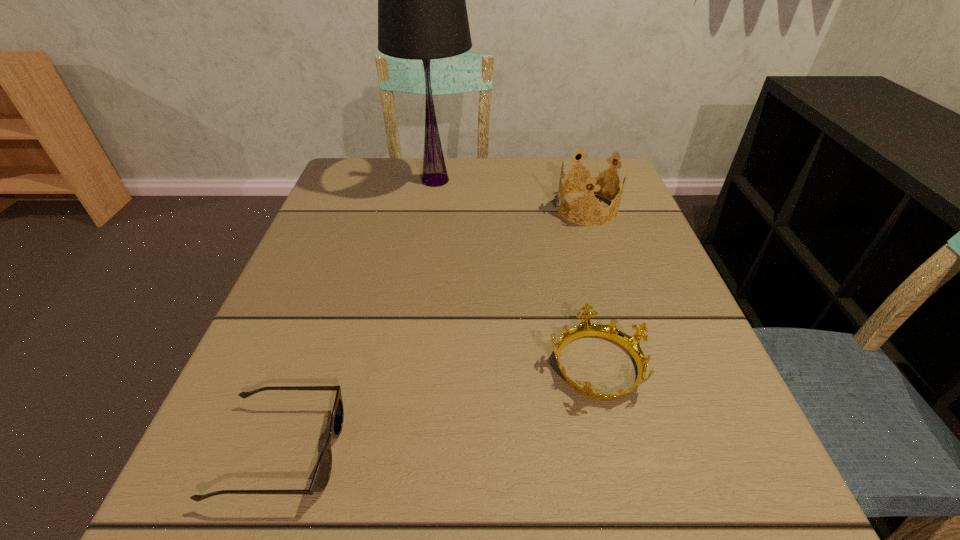
Identify the location of lampshade that is positioned at the far edge. The height and width of the screenshot is (540, 960). (422, 15).

Identify the location of crown located in the far edge section of the desktop. Image resolution: width=960 pixels, height=540 pixels. (592, 179).

The image size is (960, 540). What are the coordinates of `object present at the near edge` in the screenshot? It's located at (321, 477).

Locate an element on the screen. The image size is (960, 540). lampshade located at the left edge is located at coordinates (422, 15).

Identify the location of sunglasses that is at the left edge. The height and width of the screenshot is (540, 960). (321, 477).

Identify the location of object located at the far left corner. This screenshot has height=540, width=960. (422, 15).

The height and width of the screenshot is (540, 960). Find the location of `object positioned at the near left corner`. object positioned at the near left corner is located at coordinates (321, 477).

This screenshot has width=960, height=540. In order to click on object situated at the far right corner in this screenshot , I will do `click(592, 179)`.

Where is `vacant space at the far edge`? vacant space at the far edge is located at coordinates (467, 173).

The image size is (960, 540). Find the location of `vacant region at the near edge`. vacant region at the near edge is located at coordinates (507, 531).